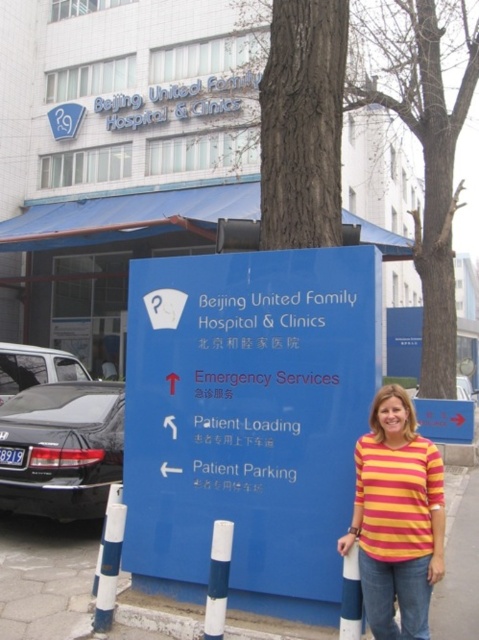
Between bark at tree at upper center and shiny black sedan at left, which one has less height?

Standing shorter between the two is shiny black sedan at left.

Can you confirm if bark at tree at upper center is shorter than shiny black sedan at left?

No.

This screenshot has width=479, height=640. I want to click on bark at tree at upper center, so click(421, 140).

Locate an element on the screen. bark at tree at upper center is located at coordinates (421, 140).

Does blue plastic sign at center have a lesser height compared to blue concrete pavement at lower center?

In fact, blue plastic sign at center may be taller than blue concrete pavement at lower center.

Consider the image. Does blue plastic sign at center have a lesser width compared to blue concrete pavement at lower center?

No, blue plastic sign at center is not thinner than blue concrete pavement at lower center.

Does point (343, 346) come closer to viewer compared to point (80, 563)?

Yes, point (343, 346) is in front of point (80, 563).

Locate an element on the screen. blue plastic sign at center is located at coordinates (248, 419).

Which of these two, blue plastic sign at center or bark at tree at upper center, stands shorter?

With less height is blue plastic sign at center.

Can you confirm if blue plastic sign at center is taller than bark at tree at upper center?

Incorrect, blue plastic sign at center's height is not larger of bark at tree at upper center's.

Where is `blue plastic sign at center`? The height and width of the screenshot is (640, 479). blue plastic sign at center is located at coordinates (248, 419).